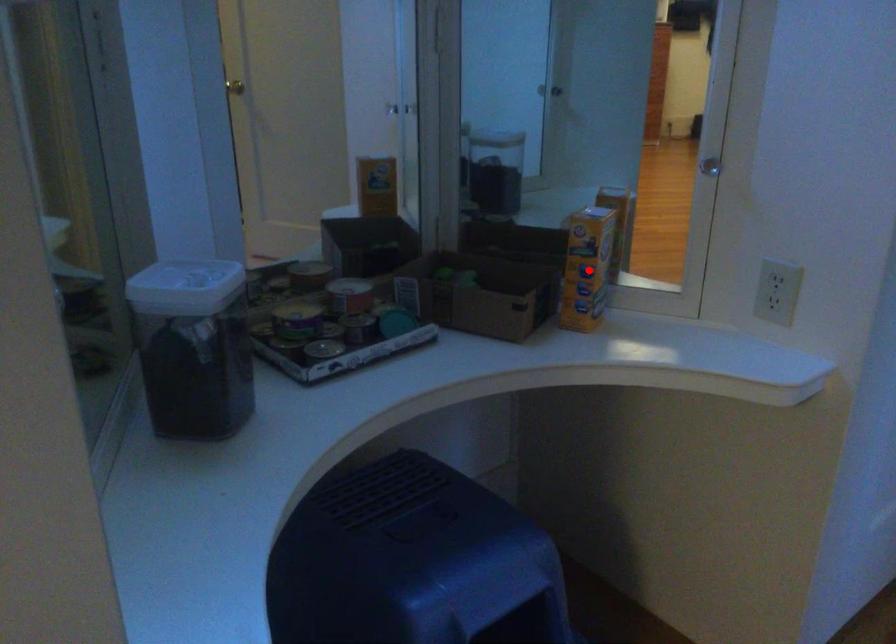
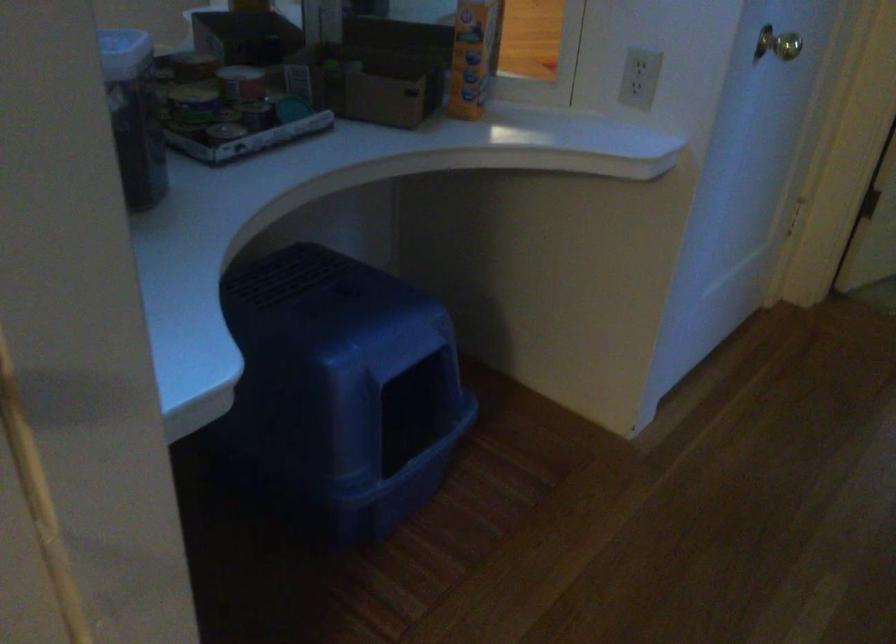
Find the pixel in the second image that matches the highlighted location in the first image.

(472, 57)